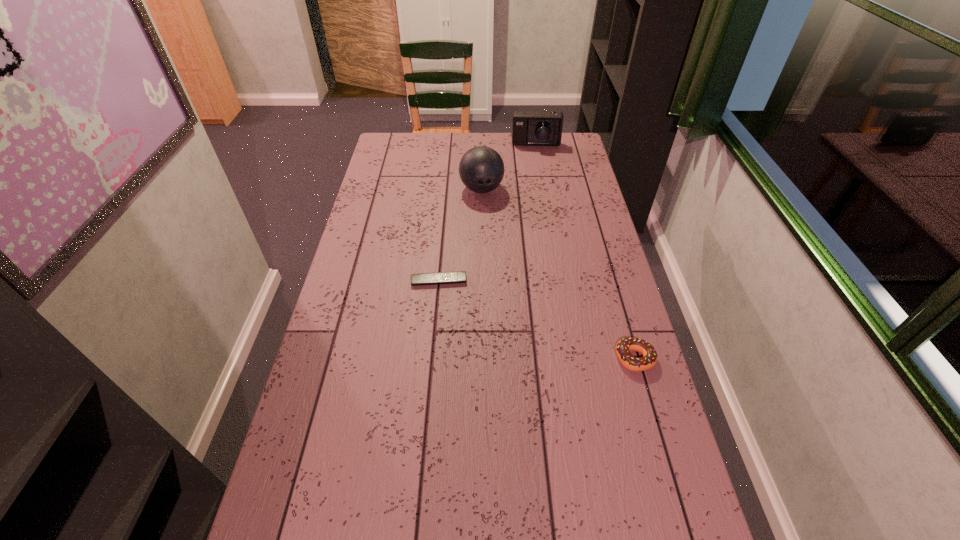
This screenshot has width=960, height=540. Find the location of `remote control`. remote control is located at coordinates (460, 276).

Find the location of `the shortest object`. the shortest object is located at coordinates (460, 276).

The width and height of the screenshot is (960, 540). Identify the location of the nearest object. (625, 345).

Find the location of a particular element. This screenshot has width=960, height=540. the rightmost object is located at coordinates (625, 345).

I want to click on the farthest object, so click(530, 128).

This screenshot has height=540, width=960. What are the coordinates of `the second object from right to left` in the screenshot? It's located at (530, 128).

Locate an element on the screen. The image size is (960, 540). the tallest object is located at coordinates (481, 169).

Where is `the second farthest object`? The height and width of the screenshot is (540, 960). the second farthest object is located at coordinates [481, 169].

At what (x,y) coordinates should I click in order to perform the action: click on vacant space located 0.100m on the left of the remote control. Please return your answer as a coordinate pair (x, y). Looking at the image, I should click on (380, 281).

The height and width of the screenshot is (540, 960). I want to click on free space located on the front of the rightmost object, so click(649, 409).